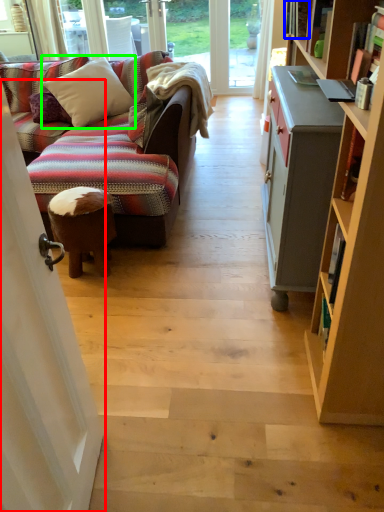
Question: Which is farther away from screen door (highlighted by a red box)? book (highlighted by a blue box) or pillow (highlighted by a green box)?

Choices:
 (A) book
 (B) pillow

Answer: (B)